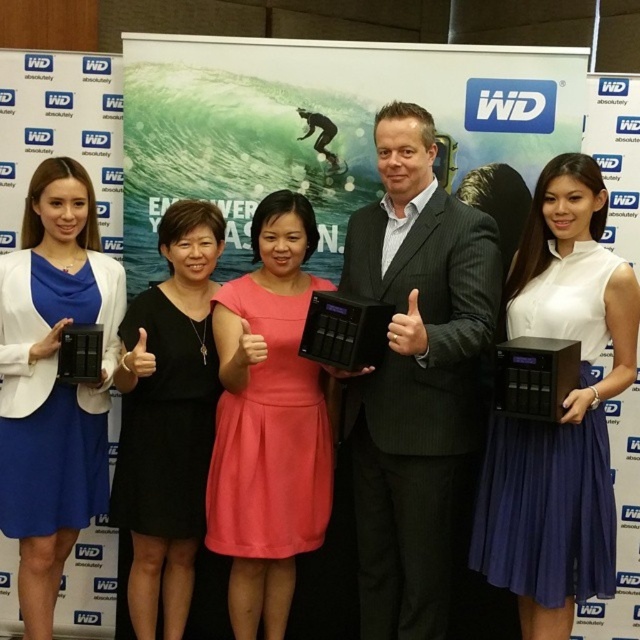
Question: Among these points, which one is nearest to the camera?

Choices:
 (A) (536, 300)
 (B) (460, 394)
 (C) (32, 200)

Answer: (A)

Question: Is white matte skirt at center below coral satin dress at center?

Choices:
 (A) no
 (B) yes

Answer: (A)

Question: From the image, what is the correct spatial relationship of black pinstripe suit at center in relation to matte black device at left?

Choices:
 (A) left
 (B) right

Answer: (B)

Question: Which point appears farthest from the camera in this image?

Choices:
 (A) coord(116,387)
 (B) coord(38,304)
 (C) coord(420,170)

Answer: (A)

Question: Which point is closer to the camera?

Choices:
 (A) (157, 449)
 (B) (534, 500)
 (C) (458, 291)
 (D) (264, 582)

Answer: (B)

Question: Is coral satin dress at center closer to the viewer compared to matte black device at left?

Choices:
 (A) yes
 (B) no

Answer: (A)